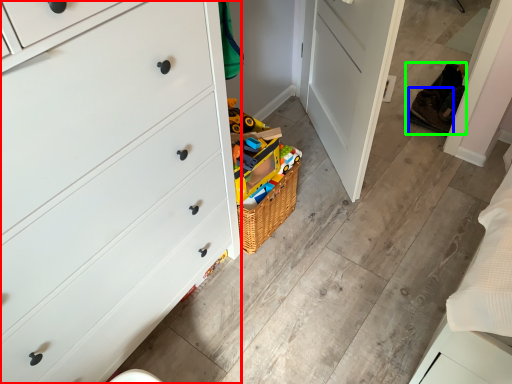
Question: Estimate the real-world distances between objects in this image. Which object is closer to chest of drawers (highlighted by a red box), shoe (highlighted by a blue box) or shoe (highlighted by a green box)?

Choices:
 (A) shoe
 (B) shoe

Answer: (B)